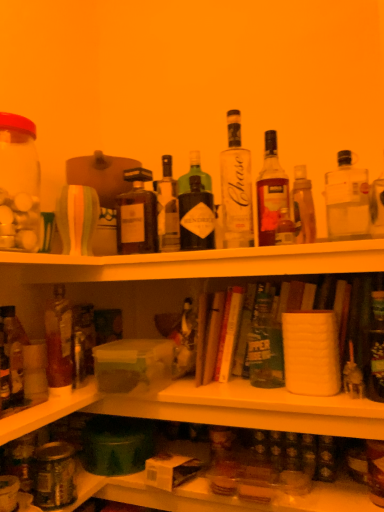
The height and width of the screenshot is (512, 384). I want to click on free space in front of green matte beer bottle at center, placed as the 5th bottle when sorted from right to left, so click(285, 394).